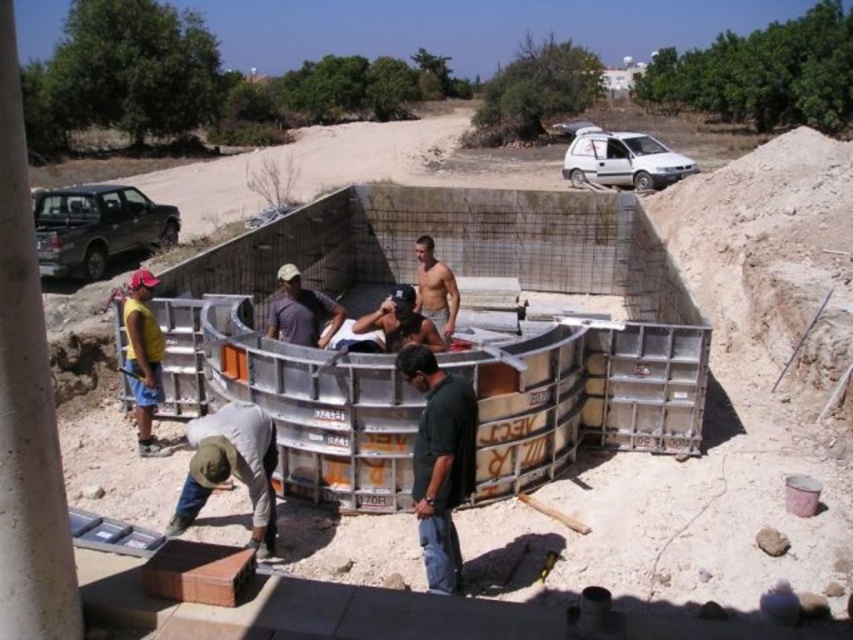
Question: From the image, what is the correct spatial relationship of green matte shirt at center in relation to shiny metallic man at center?

Choices:
 (A) below
 (B) above

Answer: (A)

Question: Is green matte shirt at center positioned in front of shiny metallic helmet at center?

Choices:
 (A) no
 (B) yes

Answer: (B)

Question: Considering the real-world distances, which object is closest to the green matte shirt at center?

Choices:
 (A) shiny metallic man at center
 (B) shiny metallic helmet at center

Answer: (B)

Question: Which of these objects is positioned farthest from the gray fabric at lower left?

Choices:
 (A) dark gray t-shirt at center
 (B) shiny metallic helmet at center

Answer: (A)

Question: Is green matte shirt at center below gray fabric at lower left?

Choices:
 (A) yes
 (B) no

Answer: (B)

Question: Which of the following is the closest to the observer?

Choices:
 (A) (419, 387)
 (B) (283, 330)

Answer: (A)